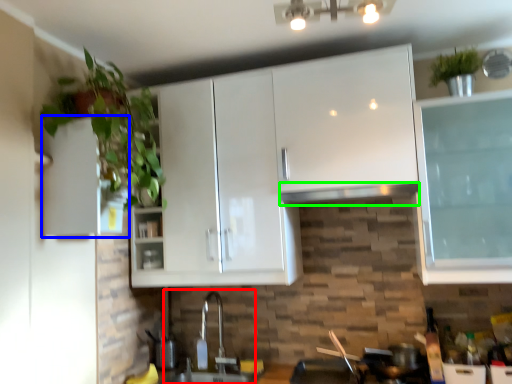
Question: Estimate the real-world distances between objects in this image. Which object is farther from sink (highlighted by a red box), cabinetry (highlighted by a blue box) or exhaust hood (highlighted by a green box)?

Choices:
 (A) cabinetry
 (B) exhaust hood

Answer: (A)